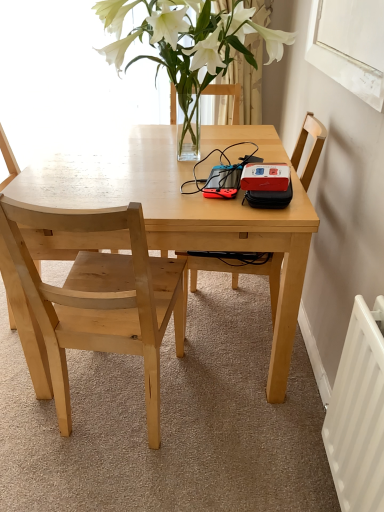
The height and width of the screenshot is (512, 384). I want to click on blank space above light wood table at center (from a real-world perspective), so click(176, 153).